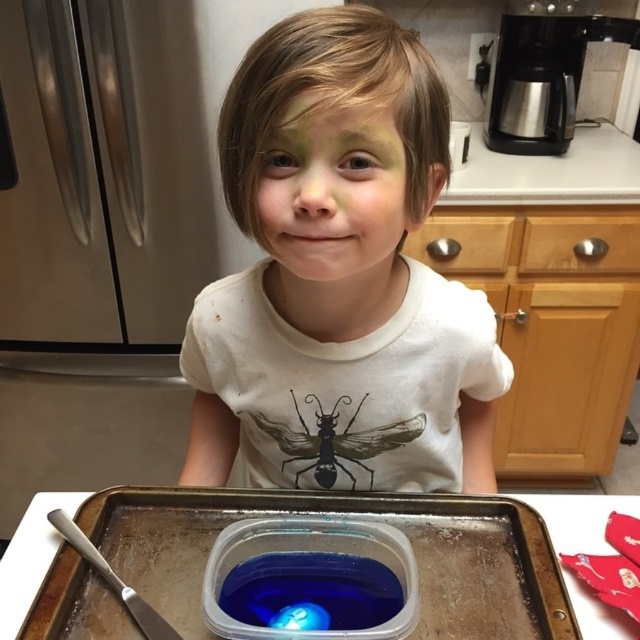
You are a chef preparing a dish and need to place both the metallic silver tray at center and the black matte insect at center on a shelf that can only hold items up to 50 cm in width. Based on their sizes, can both items fit side by side on the shelf?

The metallic silver tray at center might be wider than black matte insect at center, so it is uncertain if both can fit side by side on the shelf without exceeding the 50 cm width limit. Measure their combined width to confirm.

You are standing at the kitchen counter where the child is sitting. You need to place a small toy between the two points marked as point (337,493) and point (417,432). Which point should the toy be closer to so that it is in front of the other point?

The toy should be placed closer to point (337,493) because it is in front of point (417,432).

The child is wearing a white matte shirt at center and has a black matte insect at center on their shirt. If the shirt is 4.34 inches away from the insect, does the insect appear to be on the shirt or somewhere else?

The white matte shirt at center is 4.34 inches from the black matte insect at center, so the insect is not on the shirt but somewhere else.